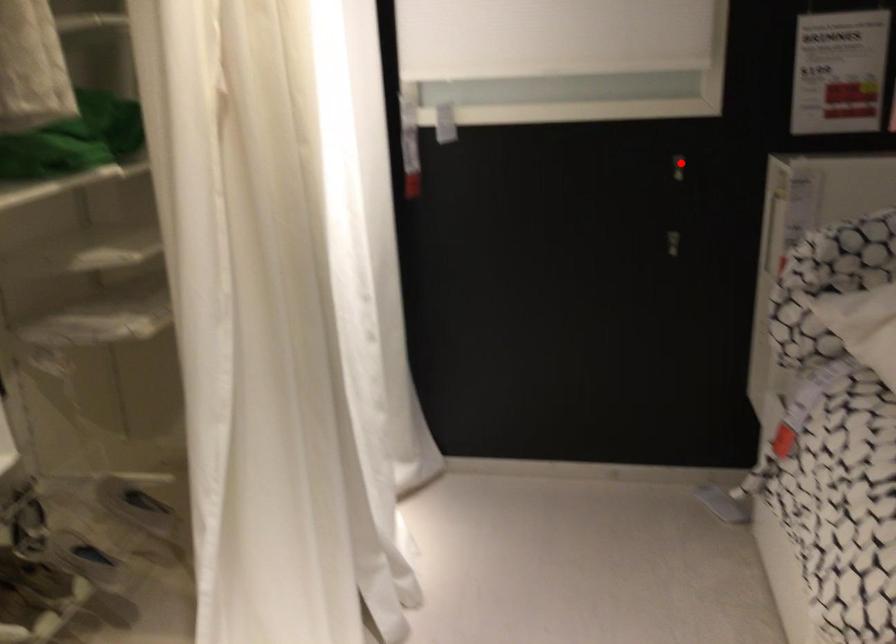
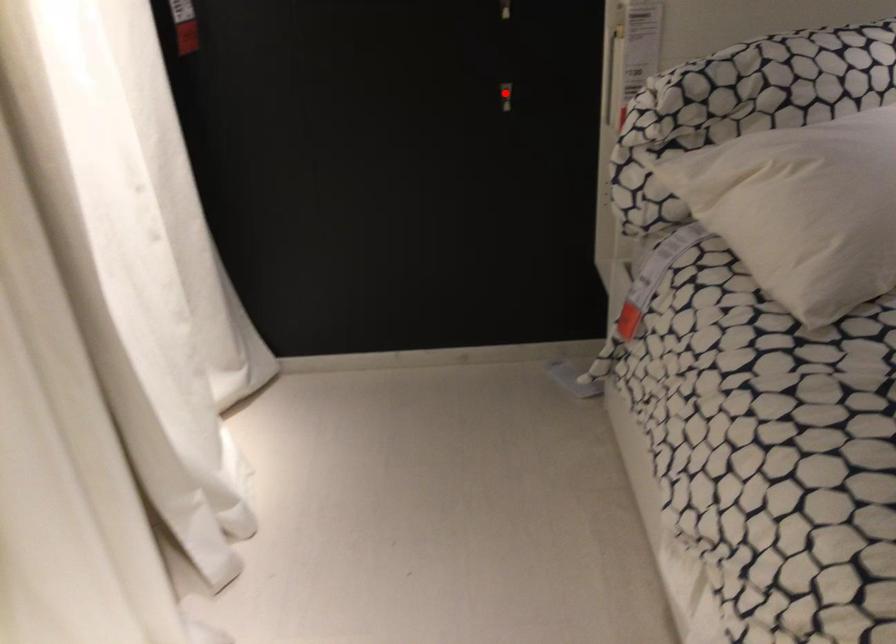
I am providing you with two images of the same scene from different viewpoints. A red point is marked on the first image and another point is marked on the second image. Does the point marked in image1 correspond to the same location as the one in image2?

No